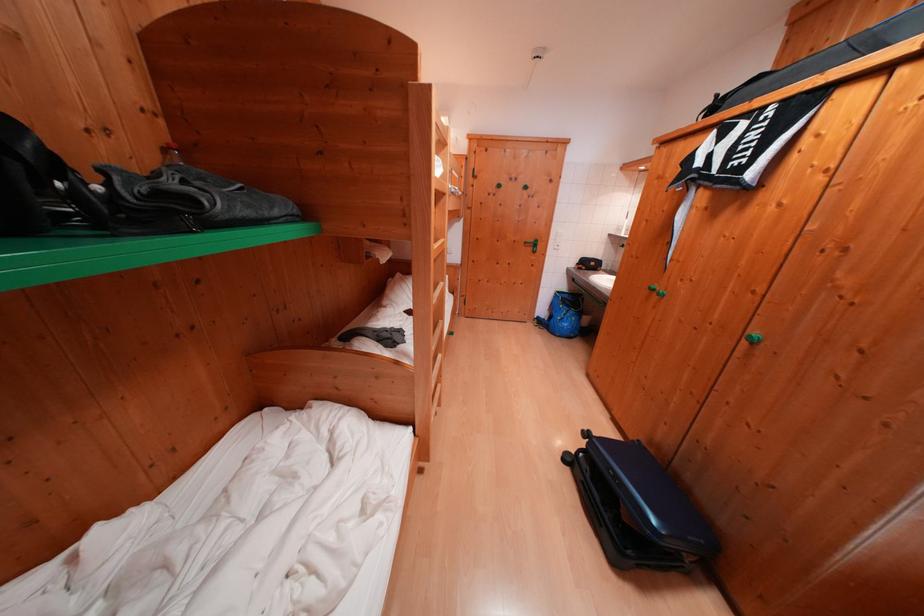
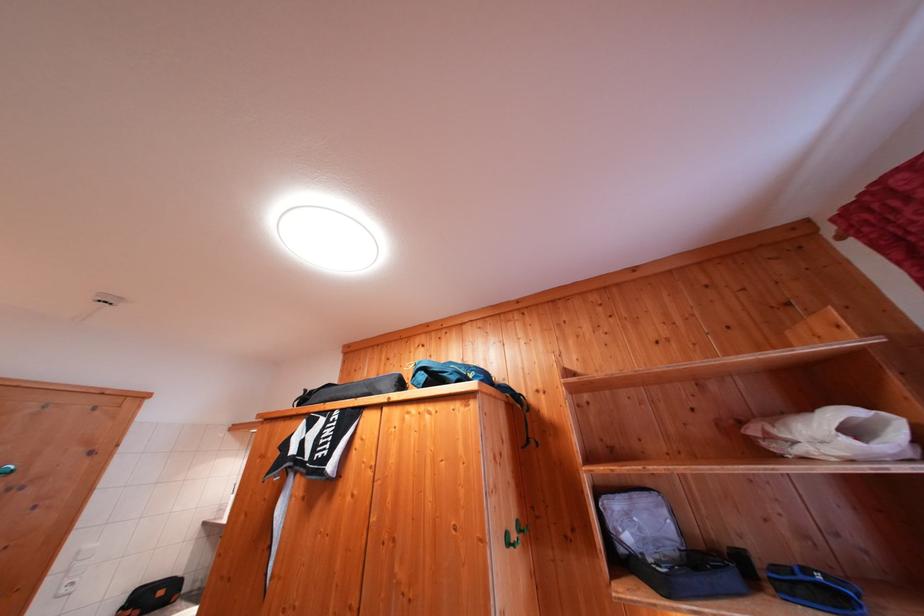
The first image is from the beginning of the video and the second image is from the end. How did the camera likely rotate when shooting the video?

The camera's rotation is toward right-up.